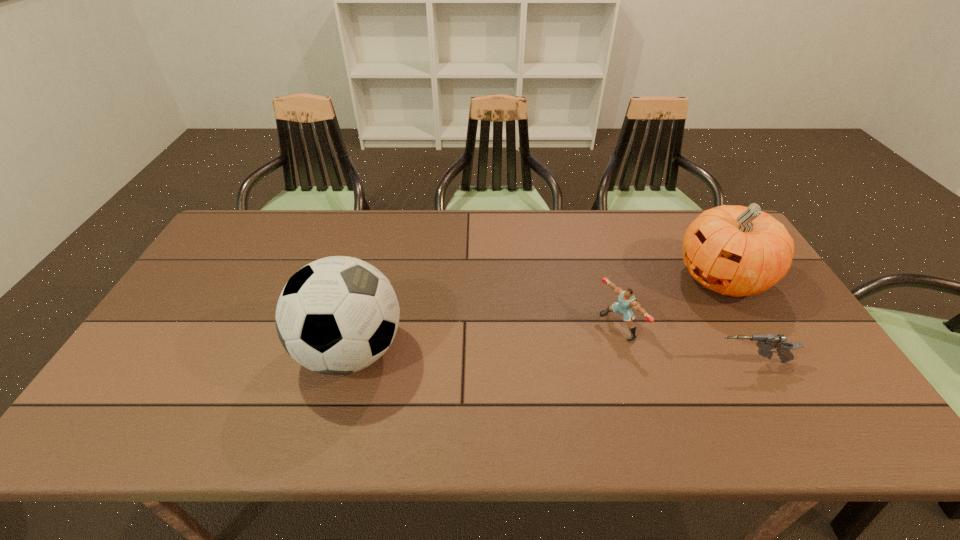
The height and width of the screenshot is (540, 960). In order to click on vacant spot on the desktop that is between the leftmost object and the shortest object and is positioned on the front-facing side of the pumpkin in this screenshot , I will do `click(566, 357)`.

This screenshot has width=960, height=540. I want to click on free space on the desktop that is between the leftmost object and the gun and is positioned on the front-facing side of the third object from right to left, so click(x=559, y=356).